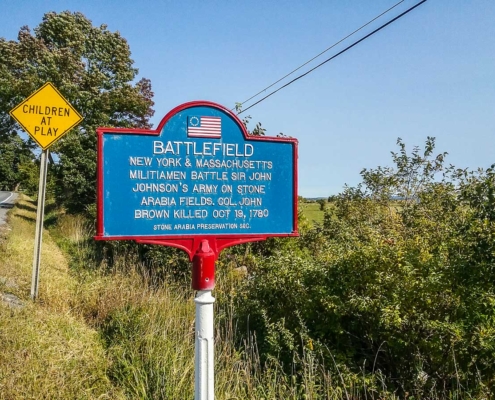
This screenshot has width=495, height=400. In order to click on wires in this screenshot , I will do `click(276, 82)`, `click(291, 80)`.